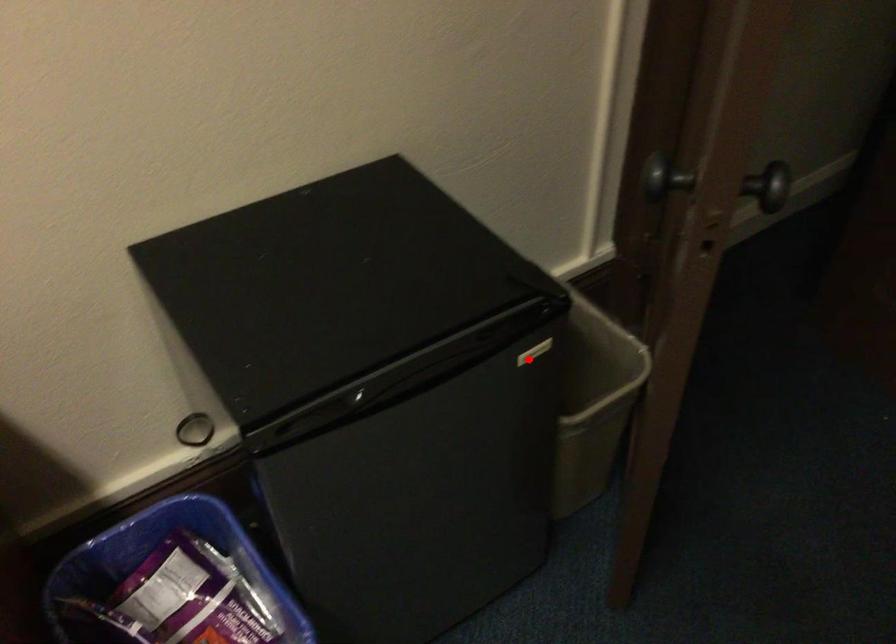
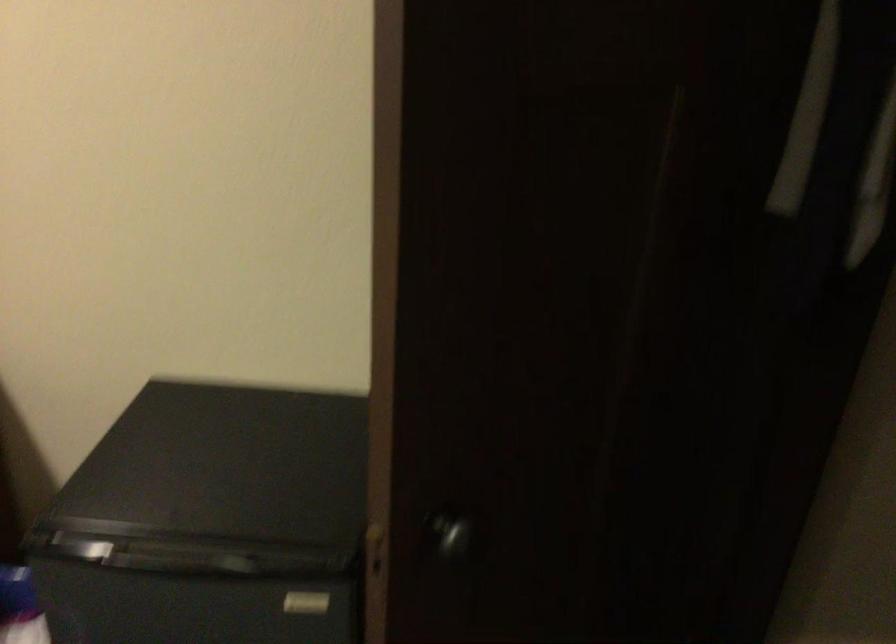
Where in the second image is the point corresponding to the highlighted location from the first image?

(306, 603)